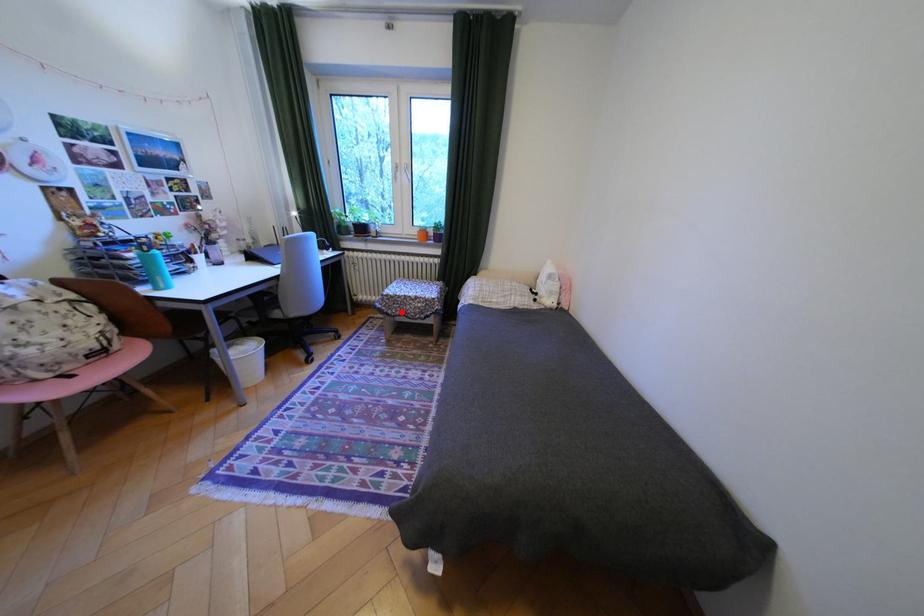
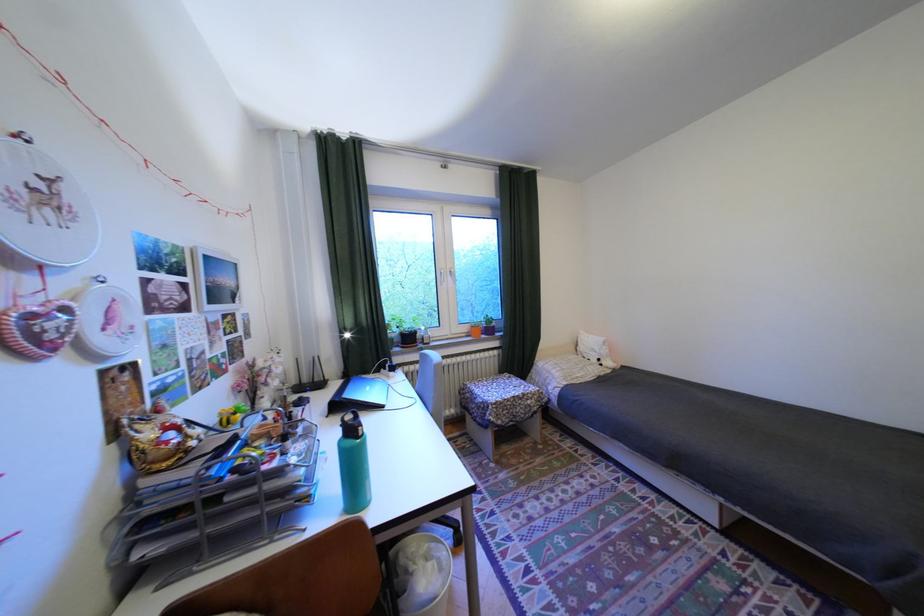
Where in the second image is the point corresponding to the highlighted location from the first image?

(512, 422)